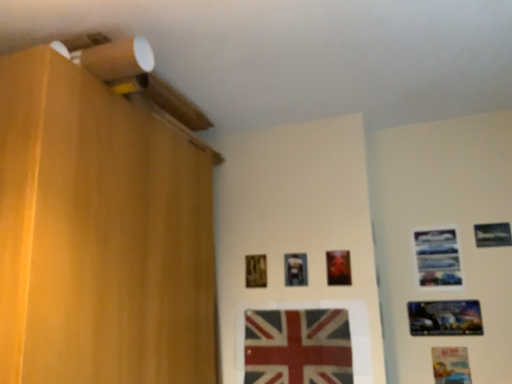
Question: Considering the relative positions of matte plastic picture frame at lower right, arranged as the second picture frame when viewed from the right, and wooden picture frame at center, acting as the first picture frame starting from the left, in the image provided, is matte plastic picture frame at lower right, arranged as the second picture frame when viewed from the right, behind wooden picture frame at center, acting as the first picture frame starting from the left,?

Choices:
 (A) no
 (B) yes

Answer: (A)

Question: Can you confirm if matte plastic picture frame at lower right, arranged as the second picture frame when viewed from the right, is shorter than wooden picture frame at center, acting as the first picture frame starting from the left?

Choices:
 (A) no
 (B) yes

Answer: (A)

Question: Is matte plastic picture frame at lower right, arranged as the second picture frame when viewed from the right, facing away from wooden picture frame at center, acting as the first picture frame starting from the left?

Choices:
 (A) yes
 (B) no

Answer: (B)

Question: Is matte plastic picture frame at lower right, arranged as the second picture frame when viewed from the right, not inside wooden picture frame at center, acting as the first picture frame starting from the left?

Choices:
 (A) no
 (B) yes

Answer: (B)

Question: Considering the relative positions of matte plastic picture frame at lower right, arranged as the second picture frame when viewed from the right, and wooden picture frame at center, acting as the first picture frame starting from the left, in the image provided, is matte plastic picture frame at lower right, arranged as the second picture frame when viewed from the right, to the right of wooden picture frame at center, acting as the first picture frame starting from the left, from the viewer's perspective?

Choices:
 (A) yes
 (B) no

Answer: (A)

Question: Is metallic reflective poster at lower right, marked as the third picture frame in a right-to-left arrangement, to the left or to the right of metallic silver picture frame at center, placed as the sixth picture frame when sorted from right to left, in the image?

Choices:
 (A) right
 (B) left

Answer: (A)

Question: From the image's perspective, is metallic reflective poster at lower right, placed as the 5th picture frame when sorted from left to right, located above or below metallic silver picture frame at center, placed as the sixth picture frame when sorted from right to left?

Choices:
 (A) above
 (B) below

Answer: (B)

Question: Choose the correct answer: Is metallic reflective poster at lower right, placed as the 5th picture frame when sorted from left to right, inside metallic silver picture frame at center, placed as the sixth picture frame when sorted from right to left, or outside it?

Choices:
 (A) outside
 (B) inside

Answer: (A)

Question: From a real-world perspective, is metallic reflective poster at lower right, marked as the third picture frame in a right-to-left arrangement, above or below metallic silver picture frame at center, the second picture frame from the left?

Choices:
 (A) below
 (B) above

Answer: (A)

Question: Relative to wooden picture frame at center, which appears as the 3th picture frame when viewed from the left, is metallic silver picture frame at upper right, which ranks as the fourth picture frame in right-to-left order, in front or behind?

Choices:
 (A) front
 (B) behind

Answer: (B)

Question: Considering the positions of metallic silver picture frame at upper right, which ranks as the fourth picture frame in right-to-left order, and wooden picture frame at center, which appears as the 3th picture frame when viewed from the left, in the image, is metallic silver picture frame at upper right, which ranks as the fourth picture frame in right-to-left order, bigger or smaller than wooden picture frame at center, which appears as the 3th picture frame when viewed from the left,?

Choices:
 (A) small
 (B) big

Answer: (B)

Question: From the image's perspective, relative to wooden picture frame at center, which appears as the 3th picture frame when viewed from the left, is metallic silver picture frame at upper right, which ranks as the fourth picture frame in right-to-left order, above or below?

Choices:
 (A) below
 (B) above

Answer: (B)

Question: Considering the positions of metallic silver picture frame at upper right, marked as the fourth picture frame in a left-to-right arrangement, and wooden picture frame at center, which is counted as the 5th picture frame, starting from the right, in the image, is metallic silver picture frame at upper right, marked as the fourth picture frame in a left-to-right arrangement, taller or shorter than wooden picture frame at center, which is counted as the 5th picture frame, starting from the right,?

Choices:
 (A) tall
 (B) short

Answer: (A)

Question: In the image, is metallic reflective poster at lower right, marked as the third picture frame in a right-to-left arrangement, on the left side or the right side of metallic silver picture frame at upper right, which ranks as the fourth picture frame in right-to-left order?

Choices:
 (A) right
 (B) left

Answer: (A)

Question: Is metallic reflective poster at lower right, placed as the 5th picture frame when sorted from left to right, inside or outside of metallic silver picture frame at upper right, marked as the fourth picture frame in a left-to-right arrangement?

Choices:
 (A) outside
 (B) inside

Answer: (A)